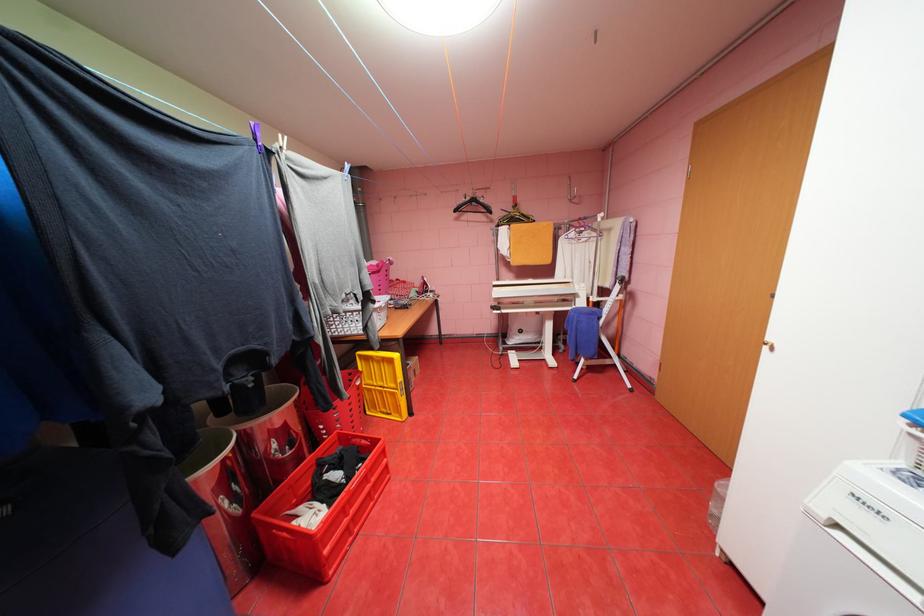
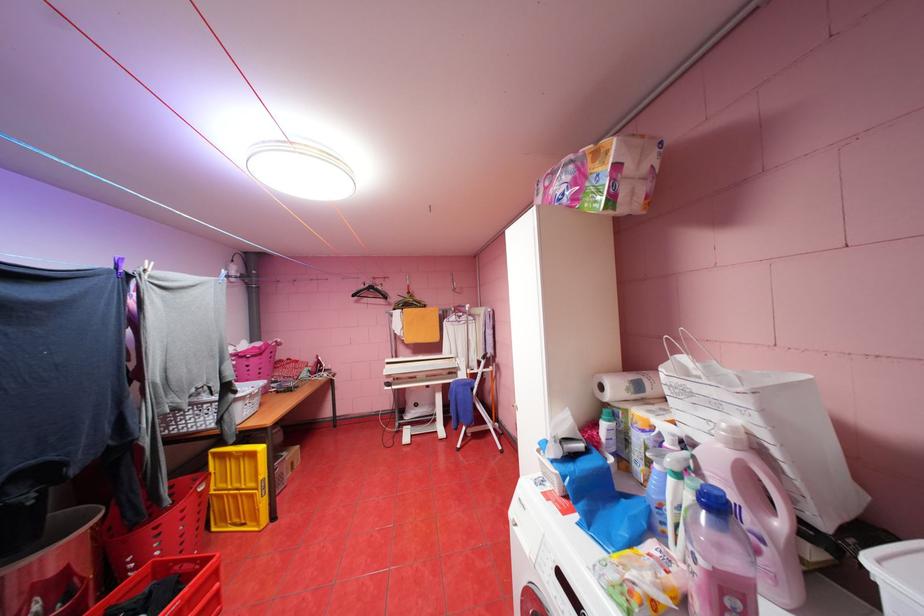
Locate, in the second image, the point that corresponds to (464,209) in the first image.

(361, 294)